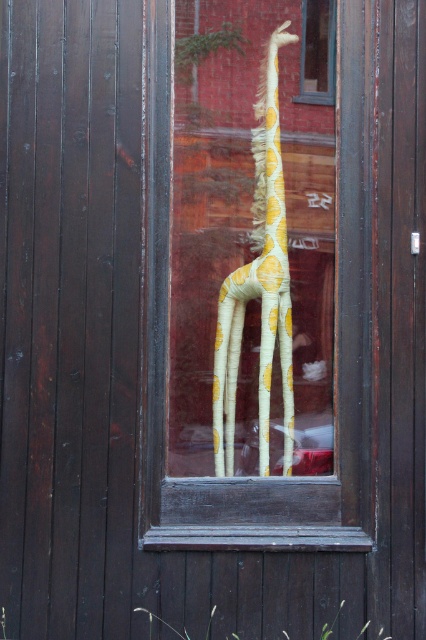
Question: Can you confirm if yellow paper giraffe at center is positioned to the right of transparent glass window at upper center?

Choices:
 (A) no
 (B) yes

Answer: (A)

Question: Can you confirm if wooden frame at center is smaller than yellow paper giraffe at center?

Choices:
 (A) yes
 (B) no

Answer: (B)

Question: Can you confirm if wooden frame at center is positioned below transparent glass window at upper center?

Choices:
 (A) no
 (B) yes

Answer: (B)

Question: Which object appears farthest from the camera in this image?

Choices:
 (A) yellow paper giraffe at center
 (B) wooden frame at center
 (C) transparent glass window at upper center

Answer: (A)

Question: Which object appears closest to the camera in this image?

Choices:
 (A) wooden frame at center
 (B) transparent glass window at upper center

Answer: (A)

Question: Which object appears farthest from the camera in this image?

Choices:
 (A) wooden frame at center
 (B) transparent glass window at upper center
 (C) yellow paper giraffe at center

Answer: (C)